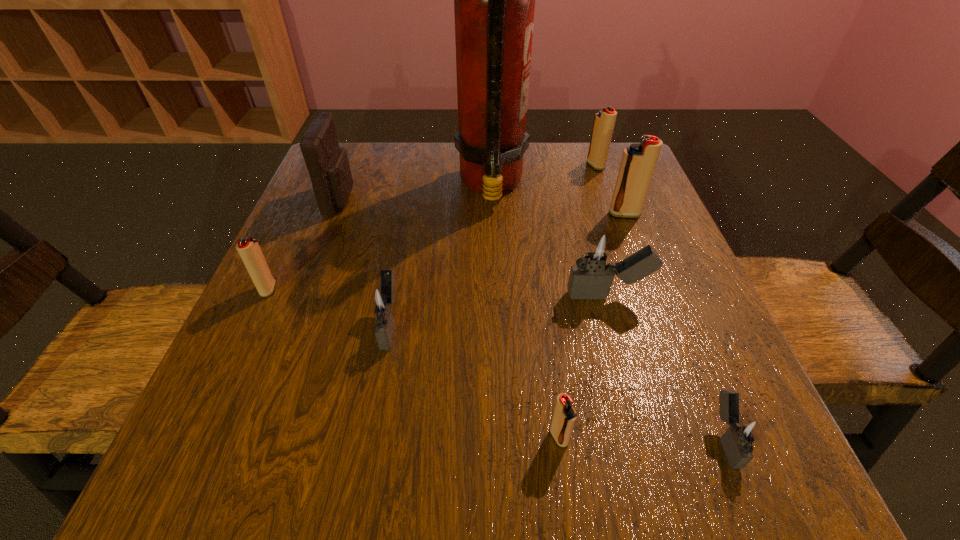
Where is `free area in between the sixth nearest igniter and the third igniter from left to right`? This screenshot has height=540, width=960. free area in between the sixth nearest igniter and the third igniter from left to right is located at coordinates (591, 325).

At what (x,y) coordinates should I click in order to perform the action: click on vacant area between the second igniter from left to right and the red fire extinguisher. Please return your answer as a coordinate pair (x, y). Looking at the image, I should click on (441, 254).

Find the location of a particular element. The image size is (960, 540). object that can be found as the eighth closest to the second smallest gray igniter is located at coordinates (604, 121).

Locate which object is the fourth closest to the farthest red igniter. Please provide its 2D coordinates. Your answer should be formatted as a tuple, i.e. [(x, y)], where the tuple contains the x and y coordinates of a point satisfying the conditions above.

[(327, 163)]

Locate an element on the screen. igniter that stands as the second closest to the nearest gray igniter is located at coordinates click(564, 417).

Identify which igniter is the fourth closest to the pouch. Please provide its 2D coordinates. Your answer should be formatted as a tuple, i.e. [(x, y)], where the tuple contains the x and y coordinates of a point satisfying the conditions above.

[(604, 121)]

Where is `the second closest red igniter to the second nearest red igniter`? the second closest red igniter to the second nearest red igniter is located at coordinates (638, 163).

Where is `red igniter that is the fourth closest to the tallest object`? red igniter that is the fourth closest to the tallest object is located at coordinates (564, 417).

Select which gray igniter is the third closest to the biggest red igniter. Please provide its 2D coordinates. Your answer should be formatted as a tuple, i.e. [(x, y)], where the tuple contains the x and y coordinates of a point satisfying the conditions above.

[(382, 300)]

Where is `gray igniter identified as the second closest to the fire extinguisher`? gray igniter identified as the second closest to the fire extinguisher is located at coordinates (382, 300).